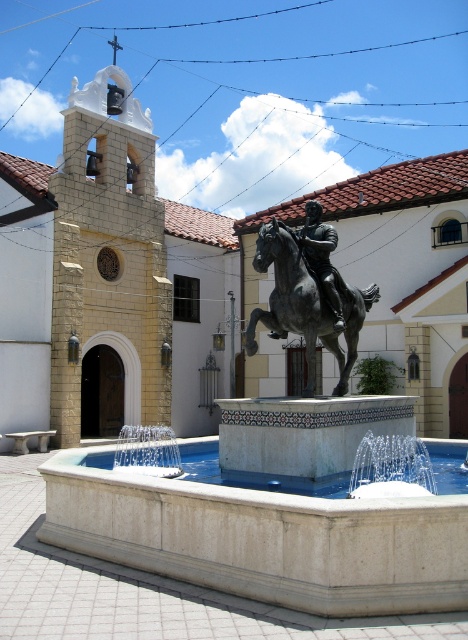
Question: Which point is closer to the camera taking this photo?

Choices:
 (A) (321, 300)
 (B) (422, 515)
 (C) (404, 380)
 (D) (321, 275)

Answer: (B)

Question: Which is nearer to the bronze metallic horse at center?

Choices:
 (A) light beige stone church at center
 (B) polished bronze statue at center
 (C) white stone fountain at center

Answer: (B)

Question: Is white stone fountain at center to the right of bronze metallic horse at center from the viewer's perspective?

Choices:
 (A) no
 (B) yes

Answer: (A)

Question: From the image, what is the correct spatial relationship of white stone fountain at center in relation to polished bronze statue at center?

Choices:
 (A) right
 (B) left

Answer: (A)

Question: Which of the following is the closest to the observer?

Choices:
 (A) light beige stone church at center
 (B) white stone fountain at center
 (C) bronze metallic horse at center

Answer: (B)

Question: Does white stone fountain at center have a greater width compared to bronze metallic horse at center?

Choices:
 (A) yes
 (B) no

Answer: (B)